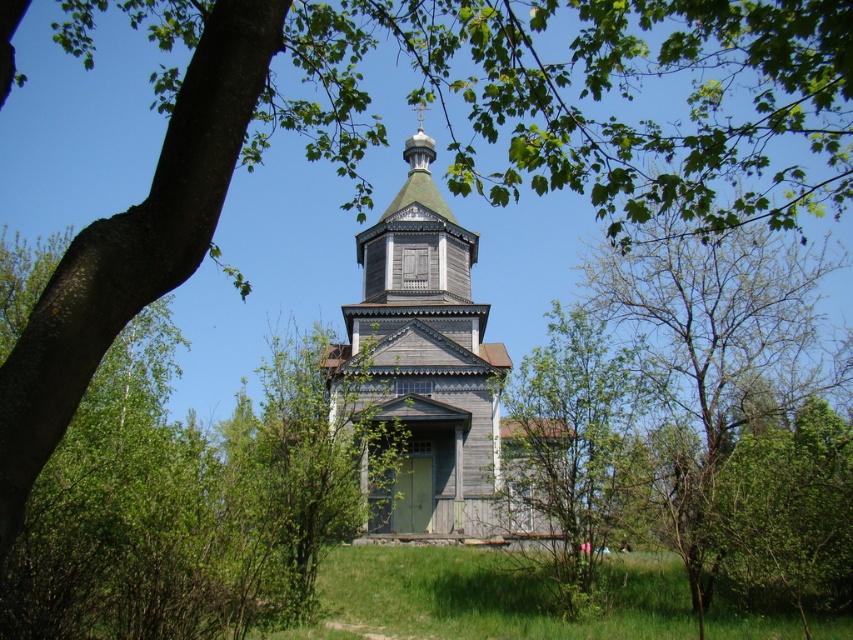
Question: Can you confirm if wooden church at center is bigger than green leafy tree at center?

Choices:
 (A) no
 (B) yes

Answer: (B)

Question: Among these objects, which one is farthest from the camera?

Choices:
 (A) wooden church at center
 (B) green leafy tree at center

Answer: (A)

Question: Which point is farther from the camera taking this photo?

Choices:
 (A) (456, 324)
 (B) (604, 356)

Answer: (B)

Question: Which object appears closest to the camera in this image?

Choices:
 (A) wooden church at center
 (B) green leafy tree at center

Answer: (B)

Question: Does wooden church at center lie behind green leafy tree at center?

Choices:
 (A) no
 (B) yes

Answer: (B)

Question: Can you confirm if wooden church at center is positioned below green leafy tree at center?

Choices:
 (A) no
 (B) yes

Answer: (A)